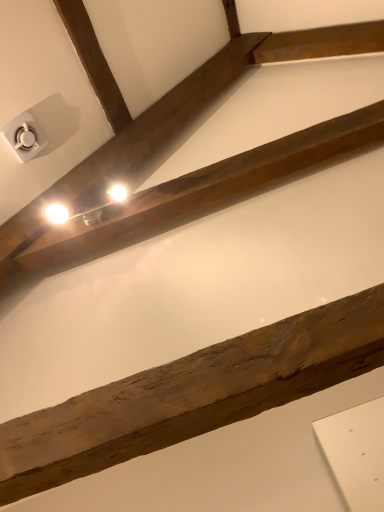
Image resolution: width=384 pixels, height=512 pixels. Identify the location of white plastic/light switch at upper left. (24, 137).

This screenshot has height=512, width=384. What do you see at coordinates (24, 137) in the screenshot? I see `white plastic/light switch at upper left` at bounding box center [24, 137].

Locate an element on the screen. Image resolution: width=384 pixels, height=512 pixels. white plastic/light switch at upper left is located at coordinates (24, 137).